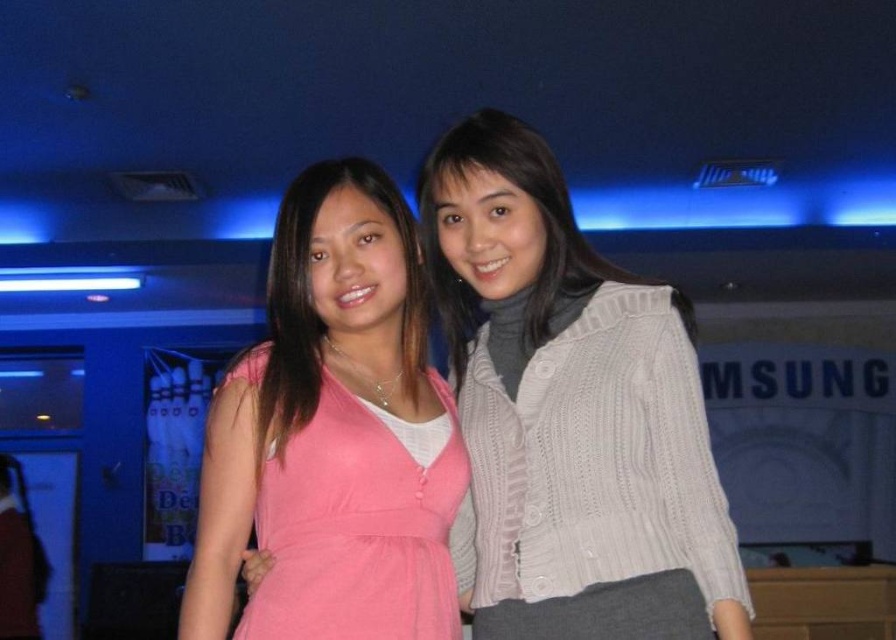
Question: Among these points, which one is nearest to the camera?

Choices:
 (A) [539, 196]
 (B) [489, 221]

Answer: (B)

Question: Which object is positioned closest to the pink matte dress at center?

Choices:
 (A) white knitted sweater at center
 (B) white knitted sweater at upper right

Answer: (B)

Question: Based on their relative distances, which object is nearer to the white knitted sweater at upper right?

Choices:
 (A) pink matte dress at center
 (B) pink fabric dress at center

Answer: (A)

Question: Does white knitted sweater at center have a lesser width compared to pink fabric dress at center?

Choices:
 (A) yes
 (B) no

Answer: (B)

Question: Is white knitted sweater at upper right thinner than pink matte dress at center?

Choices:
 (A) no
 (B) yes

Answer: (A)

Question: Can you confirm if white knitted sweater at center is positioned above pink matte dress at center?

Choices:
 (A) no
 (B) yes

Answer: (A)